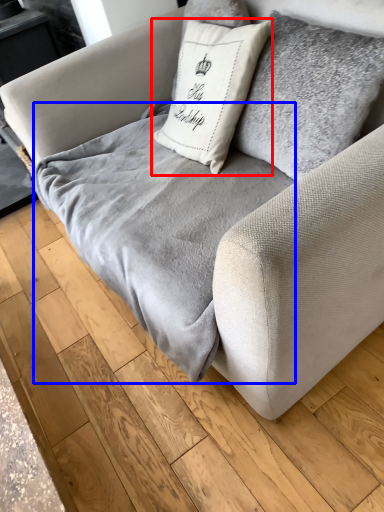
Question: Among these objects, which one is nearest to the camera, pillow (highlighted by a red box) or blanket (highlighted by a blue box)?

Choices:
 (A) pillow
 (B) blanket

Answer: (B)